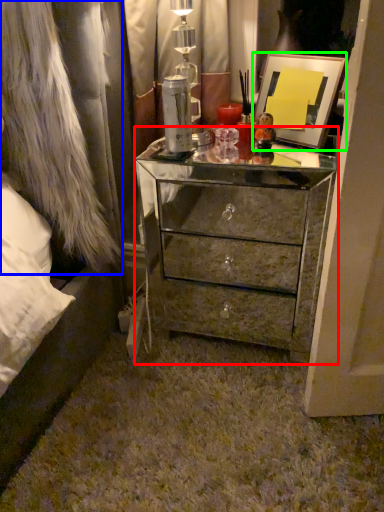
Question: Estimate the real-world distances between objects in this image. Which object is closer to chest of drawers (highlighted by a red box), fur coat (highlighted by a blue box) or picture frame (highlighted by a green box)?

Choices:
 (A) fur coat
 (B) picture frame

Answer: (B)